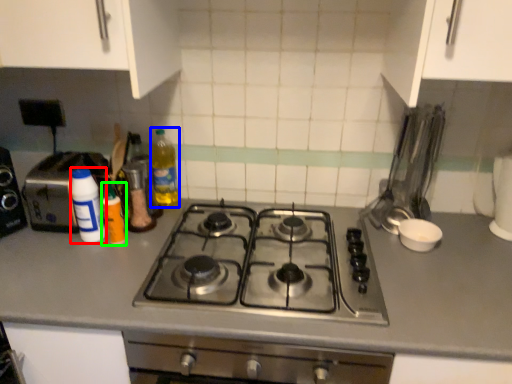
Question: Considering the real-world distances, which object is closest to bottle (highlighted by a red box)? bottle (highlighted by a blue box) or bottle (highlighted by a green box).

Choices:
 (A) bottle
 (B) bottle

Answer: (B)